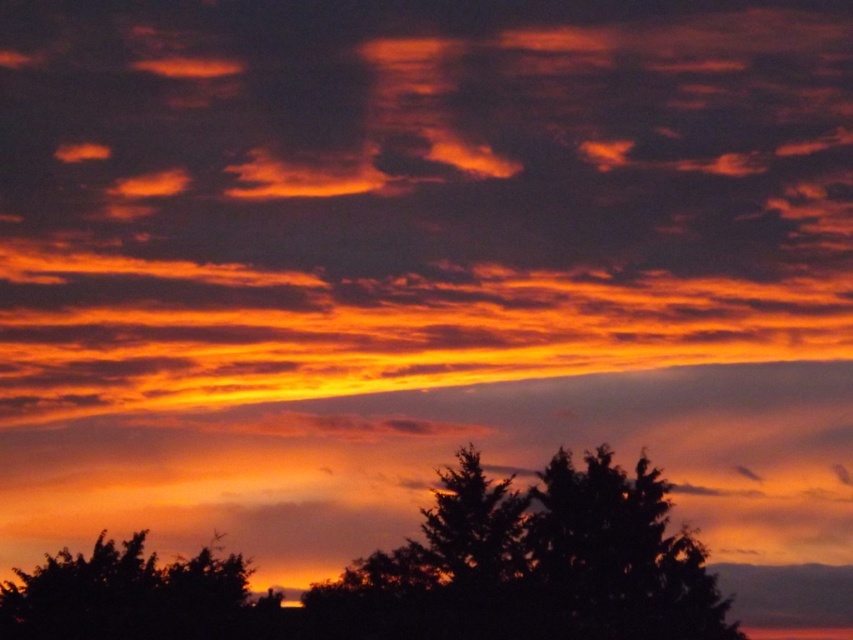
Question: Which object is farther from the camera taking this photo?

Choices:
 (A) silhouette tree at lower center
 (B) silhouette tree at lower left

Answer: (B)

Question: Is silhouette tree at lower center below silhouette tree at lower left?

Choices:
 (A) yes
 (B) no

Answer: (B)

Question: Can you confirm if silhouette tree at lower center is positioned to the left of silhouette tree at lower left?

Choices:
 (A) yes
 (B) no

Answer: (B)

Question: Which point appears closest to the camera in this image?

Choices:
 (A) (64, 604)
 (B) (434, 490)

Answer: (B)

Question: Does silhouette tree at lower center have a larger size compared to silhouette tree at lower left?

Choices:
 (A) no
 (B) yes

Answer: (B)

Question: Which point is closer to the camera taking this photo?

Choices:
 (A) (450, 476)
 (B) (109, 625)

Answer: (A)